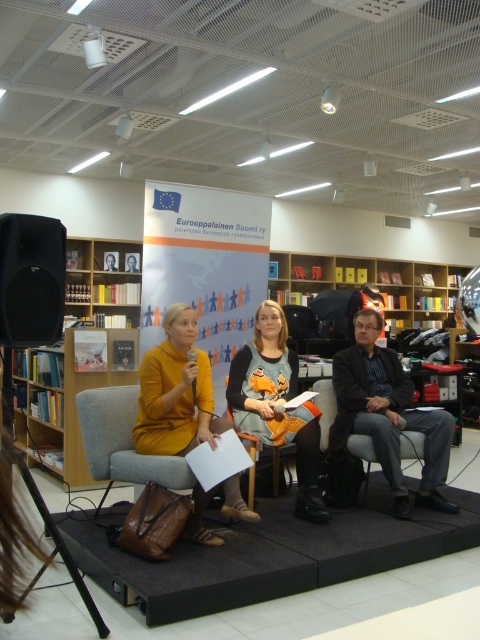
Is wooden bookshelf at left bigger than mustard yellow fabric armchair at center?

Yes.

Can you confirm if wooden bookshelf at left is positioned to the left of mustard yellow fabric armchair at center?

Correct, you'll find wooden bookshelf at left to the left of mustard yellow fabric armchair at center.

Measure the distance between wooden bookshelf at left and camera.

wooden bookshelf at left and camera are 6.73 meters apart from each other.

Where is `wooden bookshelf at left`? This screenshot has height=640, width=480. wooden bookshelf at left is located at coordinates (81, 360).

Does matte yellow sweater at center have a greater width compared to matte gray dress at center?

Yes, matte yellow sweater at center is wider than matte gray dress at center.

This screenshot has width=480, height=640. Describe the element at coordinates (176, 392) in the screenshot. I see `matte yellow sweater at center` at that location.

Is point (211, 426) farther from viewer compared to point (283, 406)?

No, (211, 426) is closer to viewer.

Where is `matte yellow sweater at center`? This screenshot has width=480, height=640. matte yellow sweater at center is located at coordinates (176, 392).

Is matte yellow sweater at center closer to the viewer compared to leather armchair at center?

That is True.

Is matte yellow sweater at center further to the viewer compared to leather armchair at center?

No.

Between point (195, 365) and point (364, 442), which one is positioned behind?

Point (364, 442)

At what (x,y) coordinates should I click in order to perform the action: click on matte yellow sweater at center. Please return your answer as a coordinate pair (x, y). The width and height of the screenshot is (480, 640). Looking at the image, I should click on (176, 392).